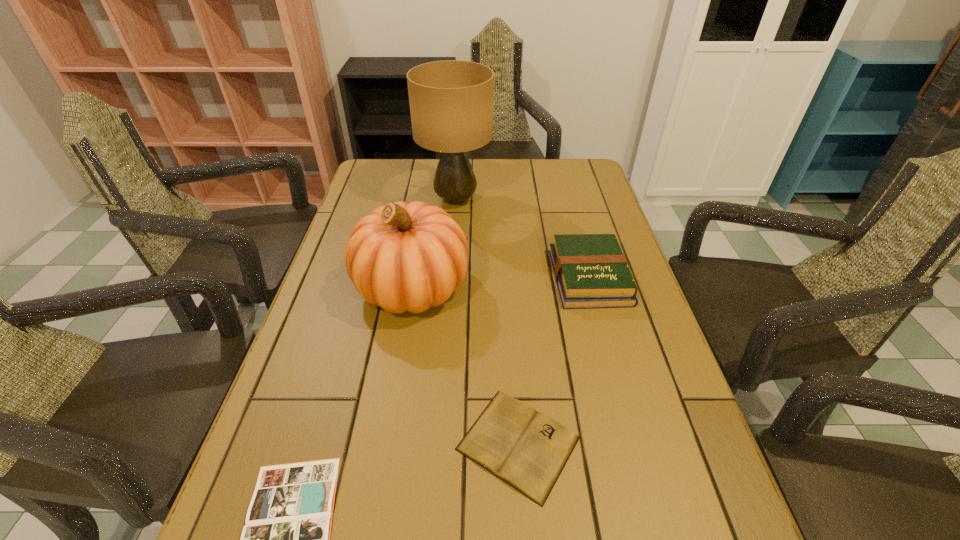
Locate an element on the screen. Image resolution: width=960 pixels, height=540 pixels. free region located 0.050m on the left of the second shortest object is located at coordinates (427, 443).

This screenshot has width=960, height=540. In order to click on object at the far edge in this screenshot , I will do `click(451, 102)`.

What are the coordinates of `object at the left edge` in the screenshot? It's located at (401, 257).

Identify the location of object positioned at the right edge. (591, 271).

This screenshot has width=960, height=540. Identify the location of vacant space at the far edge of the desktop. (518, 178).

Locate an element on the screen. This screenshot has width=960, height=540. free space at the left edge is located at coordinates (334, 352).

Find the location of `vacant region at the right edge`. vacant region at the right edge is located at coordinates (684, 443).

Identify the location of vacant space at the far left corner of the desktop. This screenshot has width=960, height=540. (376, 166).

Find the location of a particular element. This screenshot has height=540, width=960. vacant area at the far right corner is located at coordinates (561, 174).

The image size is (960, 540). Identify the location of empty location between the second book from right to left and the lampshade. (487, 321).